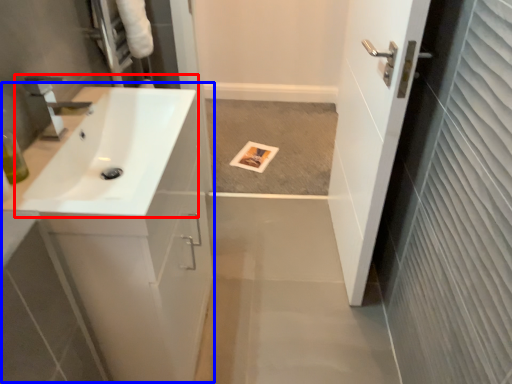
Question: Which of the following is the farthest to the observer, sink (highlighted by a red box) or counter top (highlighted by a blue box)?

Choices:
 (A) sink
 (B) counter top

Answer: (B)